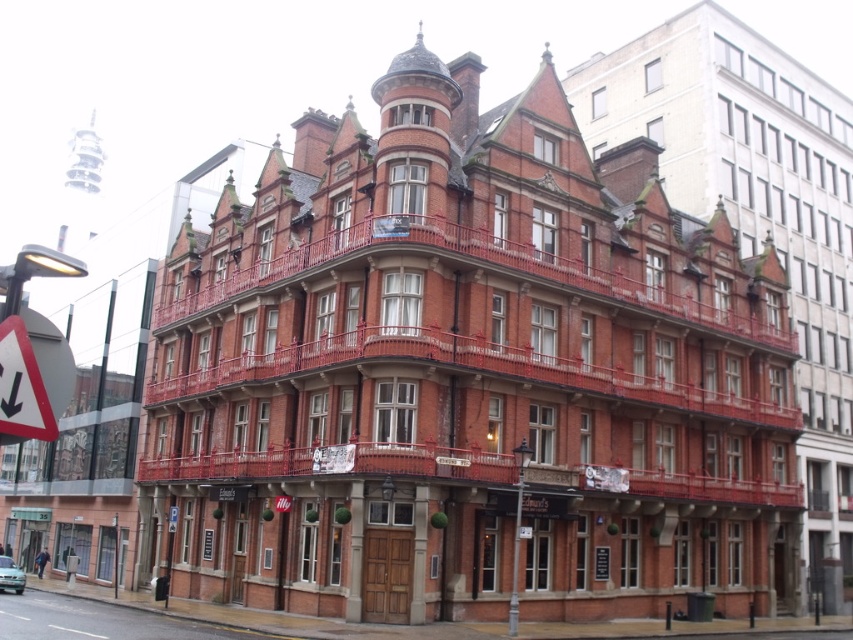
Between point (628, 109) and point (38, 403), which one is positioned in front?

Point (38, 403)

Does point (614, 140) come closer to viewer compared to point (4, 385)?

No, (614, 140) is further to viewer.

Between point (828, 438) and point (9, 420), which one is positioned behind?

Positioned behind is point (828, 438).

I want to click on brick building at center, so click(x=753, y=205).